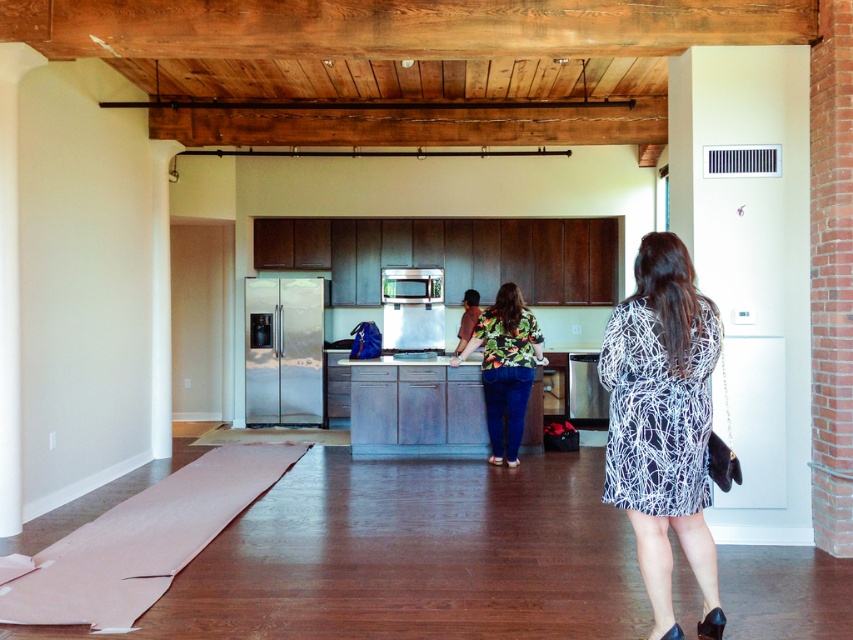
You are organizing a closet and see the black printed dress at lower right and the pink fabric yoga mat at lower left. Which item takes up more space horizontally?

The pink fabric yoga mat at lower left takes up more space horizontally because the black printed dress at lower right is thinner than it.

You are organizing a clothing rack in a modern kitchen and have two dresses to hang. The black printed dress at lower right and the floral print dress at center. Which dress should you hang higher to match their current positions in the image?

The black printed dress at lower right is taller than the floral print dress at center, so you should hang the black printed dress at lower right higher to match their current positions in the image.